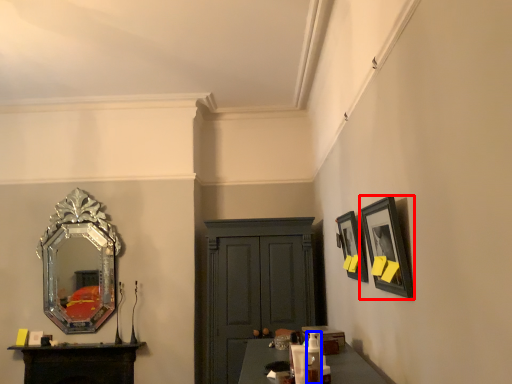
Question: Which object is closer to the camera taking this photo, picture frame (highlighted by a red box) or toiletry (highlighted by a blue box)?

Choices:
 (A) picture frame
 (B) toiletry

Answer: (A)